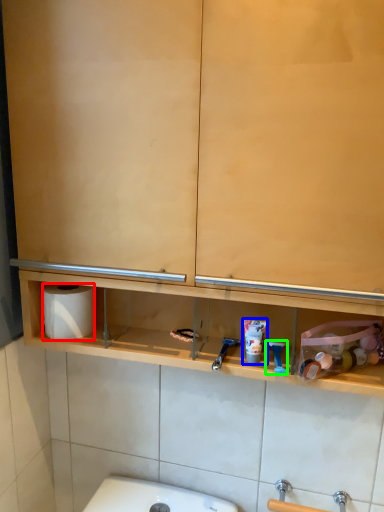
Question: Which object is positioned closest to toilet paper (highlighted by a red box)? Select from shaving cream (highlighted by a blue box) and shower (highlighted by a green box).

Choices:
 (A) shaving cream
 (B) shower

Answer: (A)